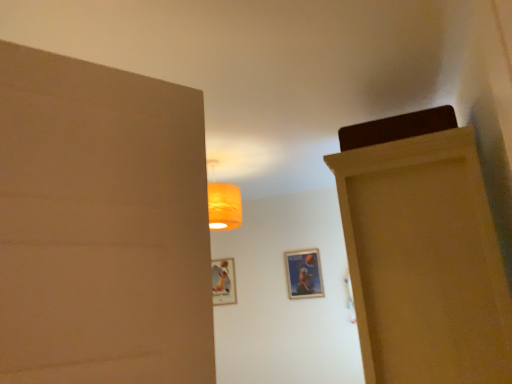
Identify the location of metallic silver picture frame at center, which is the second picture frame in back-to-front order. This screenshot has width=512, height=384. (304, 274).

Consider the image. Would you say matte plastic picture frame at center, the second picture frame positioned from the right, is outside wooden door at right?

Indeed, matte plastic picture frame at center, the second picture frame positioned from the right, is completely outside wooden door at right.

Could you tell me if matte plastic picture frame at center, the second picture frame positioned from the right, is turned towards wooden door at right?

No, matte plastic picture frame at center, the second picture frame positioned from the right, is not oriented towards wooden door at right.

From a real-world perspective, between matte plastic picture frame at center, which is the 1th picture frame from left to right, and wooden door at right, who is vertically higher?

matte plastic picture frame at center, which is the 1th picture frame from left to right.

Between matte plastic picture frame at center, which is the 1th picture frame from left to right, and wooden door at right, which one has larger width?

wooden door at right is wider.

Would you say wooden door at right is outside matte plastic picture frame at center, arranged as the 1th picture frame when viewed from the back?

wooden door at right lies outside matte plastic picture frame at center, arranged as the 1th picture frame when viewed from the back,'s area.

In order to click on door on the right side of matte plastic picture frame at center, which is the 1th picture frame from left to right in this screenshot , I will do `click(424, 262)`.

Looking at their sizes, would you say wooden door at right is wider or thinner than matte plastic picture frame at center, which is the second picture frame in front-to-back order?

In the image, wooden door at right appears to be wider than matte plastic picture frame at center, which is the second picture frame in front-to-back order.

From a real-world perspective, is wooden door at right on matte plastic picture frame at center, the second picture frame positioned from the right?

No.

Is metallic silver picture frame at center, which ranks as the first picture frame in front-to-back order, further to camera compared to wooden door at right?

Yes, metallic silver picture frame at center, which ranks as the first picture frame in front-to-back order, is further from the camera.

How many degrees apart are the facing directions of metallic silver picture frame at center, which is the second picture frame in back-to-front order, and wooden door at right?

90.4 degrees.

Is point (313, 296) more distant than point (465, 297)?

Yes.

From the image's perspective, which one is positioned higher, metallic silver picture frame at center, arranged as the first picture frame when viewed from the right, or wooden door at right?

wooden door at right.

Which object is closer to the camera taking this photo, metallic silver picture frame at center, which is the second picture frame in back-to-front order, or matte plastic picture frame at center, which is the second picture frame in front-to-back order?

metallic silver picture frame at center, which is the second picture frame in back-to-front order, is closer to the camera.

Is metallic silver picture frame at center, arranged as the first picture frame when viewed from the right, not near matte plastic picture frame at center, the second picture frame positioned from the right?

No, metallic silver picture frame at center, arranged as the first picture frame when viewed from the right, is not far away from matte plastic picture frame at center, the second picture frame positioned from the right.

Is metallic silver picture frame at center, the second picture frame viewed from the left, inside the boundaries of matte plastic picture frame at center, arranged as the 1th picture frame when viewed from the back, or outside?

metallic silver picture frame at center, the second picture frame viewed from the left, is located beyond the bounds of matte plastic picture frame at center, arranged as the 1th picture frame when viewed from the back.

Looking at the image, does metallic silver picture frame at center, which ranks as the first picture frame in front-to-back order, seem bigger or smaller compared to matte plastic picture frame at center, which is the 1th picture frame from left to right?

Clearly, metallic silver picture frame at center, which ranks as the first picture frame in front-to-back order, is smaller in size than matte plastic picture frame at center, which is the 1th picture frame from left to right.

In terms of width, does wooden door at right look wider or thinner when compared to metallic silver picture frame at center, arranged as the first picture frame when viewed from the right?

In the image, wooden door at right appears to be wider than metallic silver picture frame at center, arranged as the first picture frame when viewed from the right.

Which object is closer to the camera taking this photo, wooden door at right or metallic silver picture frame at center, arranged as the first picture frame when viewed from the right?

wooden door at right is in front.

In terms of size, does wooden door at right appear bigger or smaller than metallic silver picture frame at center, which ranks as the first picture frame in front-to-back order?

Considering their sizes, wooden door at right takes up more space than metallic silver picture frame at center, which ranks as the first picture frame in front-to-back order.

From a real-world perspective, is wooden door at right positioned above or below metallic silver picture frame at center, which is the second picture frame in back-to-front order?

Clearly, from a real-world perspective, wooden door at right is below metallic silver picture frame at center, which is the second picture frame in back-to-front order.

Considering the sizes of matte plastic picture frame at center, which is the 1th picture frame from left to right, and metallic silver picture frame at center, which is the second picture frame in back-to-front order, in the image, is matte plastic picture frame at center, which is the 1th picture frame from left to right, bigger or smaller than metallic silver picture frame at center, which is the second picture frame in back-to-front order,?

matte plastic picture frame at center, which is the 1th picture frame from left to right, is bigger than metallic silver picture frame at center, which is the second picture frame in back-to-front order.

Considering the sizes of objects matte plastic picture frame at center, the second picture frame positioned from the right, and metallic silver picture frame at center, which is the second picture frame in back-to-front order, in the image provided, who is shorter, matte plastic picture frame at center, the second picture frame positioned from the right, or metallic silver picture frame at center, which is the second picture frame in back-to-front order,?

metallic silver picture frame at center, which is the second picture frame in back-to-front order, is shorter.

Which object is further away from the camera, matte plastic picture frame at center, which is the 1th picture frame from left to right, or metallic silver picture frame at center, arranged as the first picture frame when viewed from the right?

matte plastic picture frame at center, which is the 1th picture frame from left to right.

I want to click on door in front of the matte plastic picture frame at center, which is the second picture frame in front-to-back order, so click(424, 262).

You are a GUI agent. You are given a task and a screenshot of the screen. Output one action in this format:
    pyautogui.click(x=<x>, y=<y>)
    Task: Click on the 2nd picture frame counting from the left of the wooden door at right
    The image size is (512, 384).
    Given the screenshot: What is the action you would take?
    pyautogui.click(x=223, y=281)

Considering their positions, is metallic silver picture frame at center, arranged as the first picture frame when viewed from the right, positioned further to matte plastic picture frame at center, which is the 1th picture frame from left to right, than wooden door at right?

Based on the image, wooden door at right appears to be further to matte plastic picture frame at center, which is the 1th picture frame from left to right.

From the image, which object appears to be nearer to matte plastic picture frame at center, arranged as the 1th picture frame when viewed from the back, wooden door at right or metallic silver picture frame at center, arranged as the first picture frame when viewed from the right?

Based on the image, metallic silver picture frame at center, arranged as the first picture frame when viewed from the right, appears to be nearer to matte plastic picture frame at center, arranged as the 1th picture frame when viewed from the back.

Considering their positions, is matte plastic picture frame at center, the second picture frame positioned from the right, positioned closer to wooden door at right than metallic silver picture frame at center, which is the second picture frame in back-to-front order?

Based on the image, metallic silver picture frame at center, which is the second picture frame in back-to-front order, appears to be nearer to wooden door at right.

Which object lies further to the anchor point wooden door at right, metallic silver picture frame at center, the second picture frame viewed from the left, or matte plastic picture frame at center, which is the 1th picture frame from left to right?

matte plastic picture frame at center, which is the 1th picture frame from left to right, lies further to wooden door at right than the other object.

From the image, which object appears to be nearer to metallic silver picture frame at center, which ranks as the first picture frame in front-to-back order, wooden door at right or matte plastic picture frame at center, which is the 1th picture frame from left to right?

matte plastic picture frame at center, which is the 1th picture frame from left to right, is positioned closer to the anchor metallic silver picture frame at center, which ranks as the first picture frame in front-to-back order.

When comparing their distances from metallic silver picture frame at center, which is the second picture frame in back-to-front order, does matte plastic picture frame at center, which is the second picture frame in front-to-back order, or wooden door at right seem further?

wooden door at right is further to metallic silver picture frame at center, which is the second picture frame in back-to-front order.

The height and width of the screenshot is (384, 512). Find the location of `picture frame located between wooden door at right and matte plastic picture frame at center, the second picture frame positioned from the right, in the depth direction`. picture frame located between wooden door at right and matte plastic picture frame at center, the second picture frame positioned from the right, in the depth direction is located at coordinates click(304, 274).